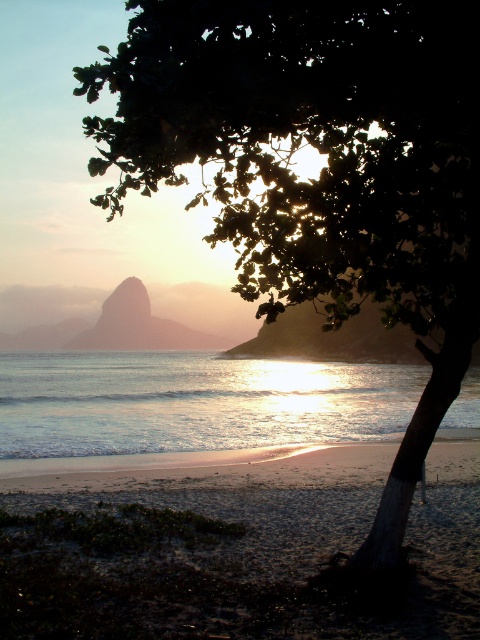
Question: Which object is farther from the camera taking this photo?

Choices:
 (A) shiny metallic water at center
 (B) sandy beach at lower left

Answer: (A)

Question: In this image, where is sandy beach at lower left located relative to shiny metallic water at center?

Choices:
 (A) above
 (B) below

Answer: (B)

Question: Considering the relative positions of sandy beach at lower left and shiny metallic water at center in the image provided, where is sandy beach at lower left located with respect to shiny metallic water at center?

Choices:
 (A) right
 (B) left

Answer: (A)

Question: Is sandy beach at lower left further to camera compared to shiny metallic water at center?

Choices:
 (A) yes
 (B) no

Answer: (B)